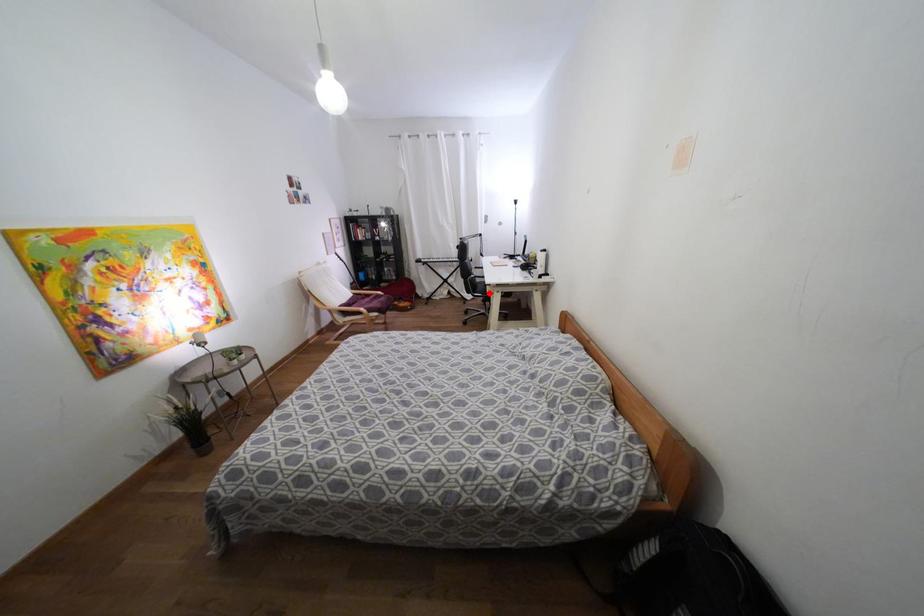
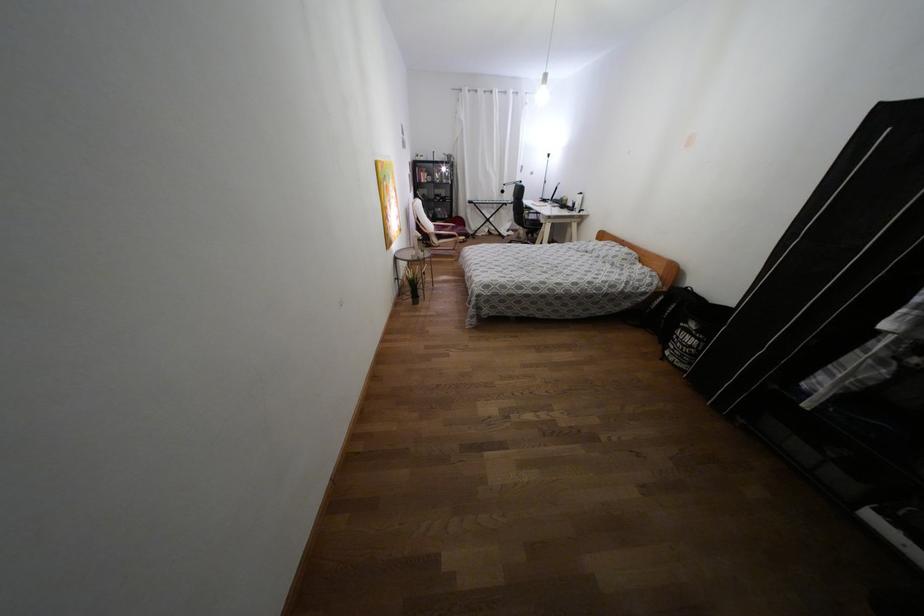
In the second image, find the point that corresponds to the highlighted location in the first image.

(541, 224)